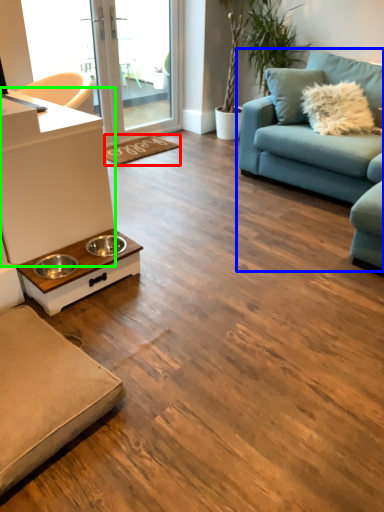
Question: Based on their relative distances, which object is farther from doormat (highlighted by a red box)? Choose from studio couch (highlighted by a blue box) and counter top (highlighted by a green box).

Choices:
 (A) studio couch
 (B) counter top

Answer: (B)